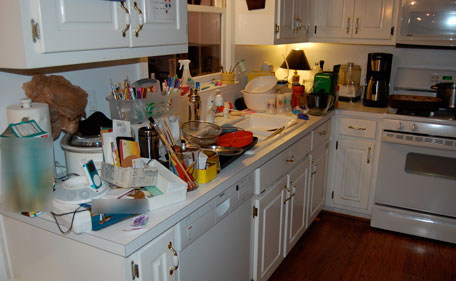
Image resolution: width=456 pixels, height=281 pixels. What are the coordinates of `oven` in the screenshot? It's located at (421, 175).